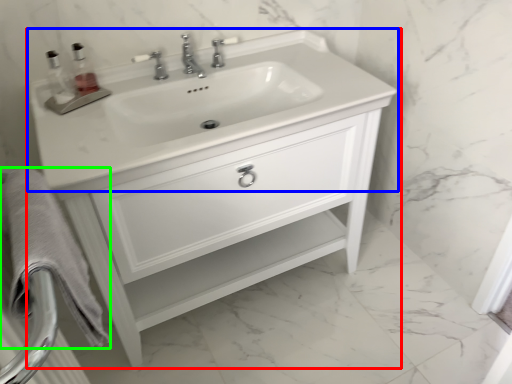
Question: Estimate the real-world distances between objects in this image. Which object is farther from bathroom cabinet (highlighted by a red box), sink (highlighted by a blue box) or bath towel (highlighted by a green box)?

Choices:
 (A) sink
 (B) bath towel

Answer: (B)